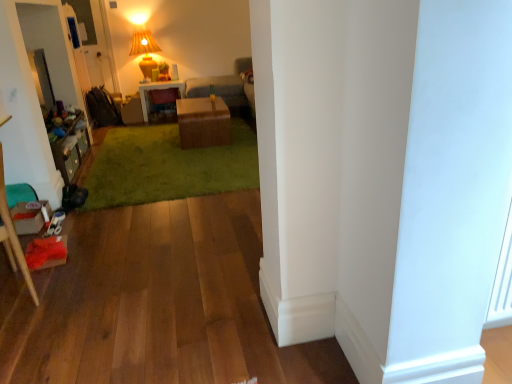
Locate an element on the screen. The width and height of the screenshot is (512, 384). free space in front of brown cardboard box at center is located at coordinates (206, 154).